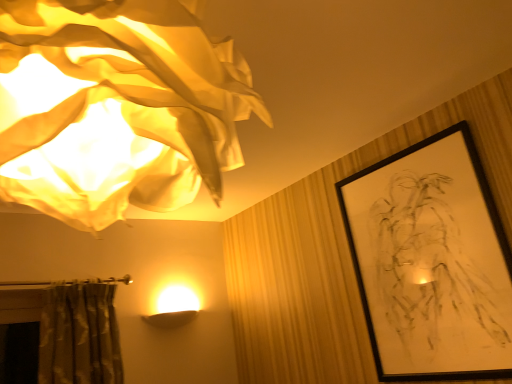
Question: Can you confirm if matte white fabric lampshade at upper left is taller than black matte picture frame at upper right?

Choices:
 (A) yes
 (B) no

Answer: (B)

Question: From the image's perspective, is matte white fabric lampshade at upper left on black matte picture frame at upper right?

Choices:
 (A) yes
 (B) no

Answer: (A)

Question: Can you confirm if matte white fabric lampshade at upper left is bigger than black matte picture frame at upper right?

Choices:
 (A) yes
 (B) no

Answer: (A)

Question: Considering the relative sizes of matte white fabric lampshade at upper left and black matte picture frame at upper right in the image provided, is matte white fabric lampshade at upper left thinner than black matte picture frame at upper right?

Choices:
 (A) yes
 (B) no

Answer: (B)

Question: Considering the relative positions of matte white fabric lampshade at upper left and black matte picture frame at upper right in the image provided, is matte white fabric lampshade at upper left to the left of black matte picture frame at upper right from the viewer's perspective?

Choices:
 (A) yes
 (B) no

Answer: (A)

Question: From a real-world perspective, is matte white fabric lampshade at upper left on top of black matte picture frame at upper right?

Choices:
 (A) no
 (B) yes

Answer: (B)

Question: Would you say black matte picture frame at upper right is outside matte white fabric lampshade at upper left?

Choices:
 (A) no
 (B) yes

Answer: (B)

Question: Is black matte picture frame at upper right beside matte white fabric lampshade at upper left?

Choices:
 (A) yes
 (B) no

Answer: (B)

Question: From a real-world perspective, is black matte picture frame at upper right over matte white fabric lampshade at upper left?

Choices:
 (A) yes
 (B) no

Answer: (B)

Question: From the image's perspective, does black matte picture frame at upper right appear lower than matte white fabric lampshade at upper left?

Choices:
 (A) no
 (B) yes

Answer: (B)

Question: Can you confirm if black matte picture frame at upper right is wider than matte white fabric lampshade at upper left?

Choices:
 (A) no
 (B) yes

Answer: (A)

Question: Is there a large distance between black matte picture frame at upper right and matte white fabric lampshade at upper left?

Choices:
 (A) yes
 (B) no

Answer: (A)

Question: From the image's perspective, is black matte picture frame at upper right located above or below matte white fabric lampshade at upper left?

Choices:
 (A) above
 (B) below

Answer: (B)